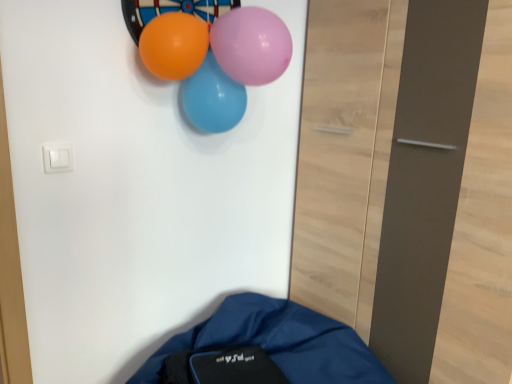
Question: From a real-world perspective, relative to purple glossy balloon at upper center, which is the 3th balloon in back-to-front order, is orange glossy balloon at upper center, the 2th balloon positioned from the back, vertically above or below?

Choices:
 (A) above
 (B) below

Answer: (B)

Question: In terms of height, does orange glossy balloon at upper center, arranged as the 2th balloon when viewed from the front, look taller or shorter compared to purple glossy balloon at upper center, placed as the first balloon when sorted from front to back?

Choices:
 (A) short
 (B) tall

Answer: (A)

Question: Which object is the farthest from the purple glossy balloon at upper center, placed as the first balloon when sorted from front to back?

Choices:
 (A) blue glossy balloon at upper center, the third balloon from the front
 (B) orange glossy balloon at upper center, the 2th balloon positioned from the back

Answer: (A)

Question: Considering the real-world distances, which object is farthest from the blue glossy balloon at upper center, the third balloon from the front?

Choices:
 (A) purple glossy balloon at upper center, which is the 3th balloon in back-to-front order
 (B) orange glossy balloon at upper center, the 2th balloon positioned from the back

Answer: (A)